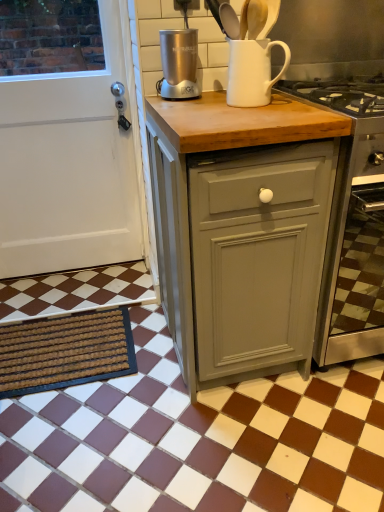
I want to click on vacant space in front of satin silver blender at center, so click(x=187, y=104).